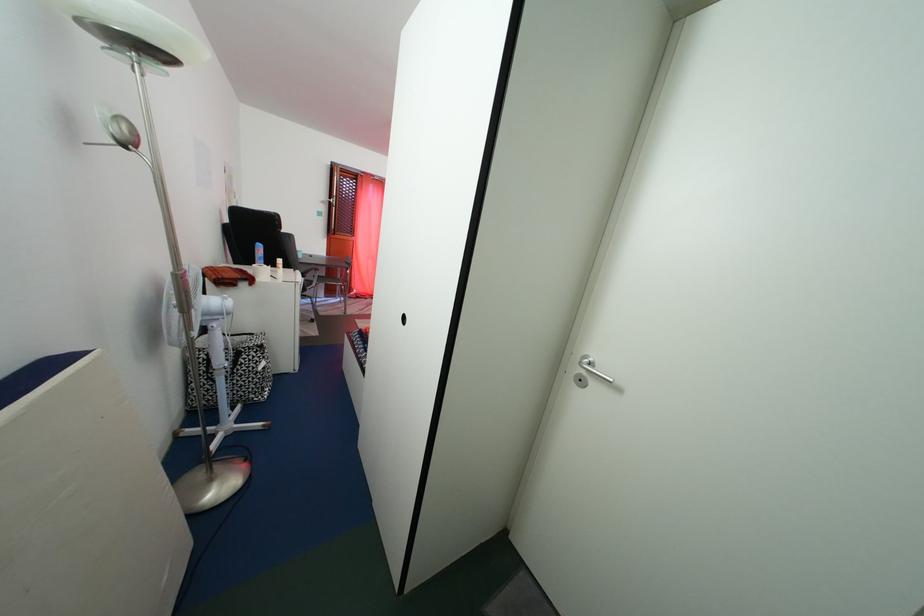
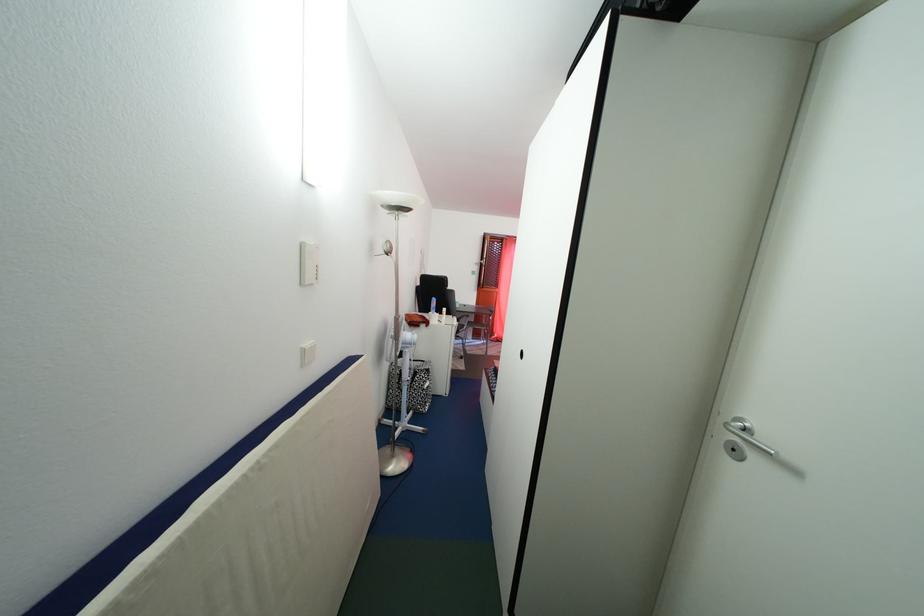
Locate, in the second image, the point that corresponds to point 594,363 in the first image.

(748, 426)